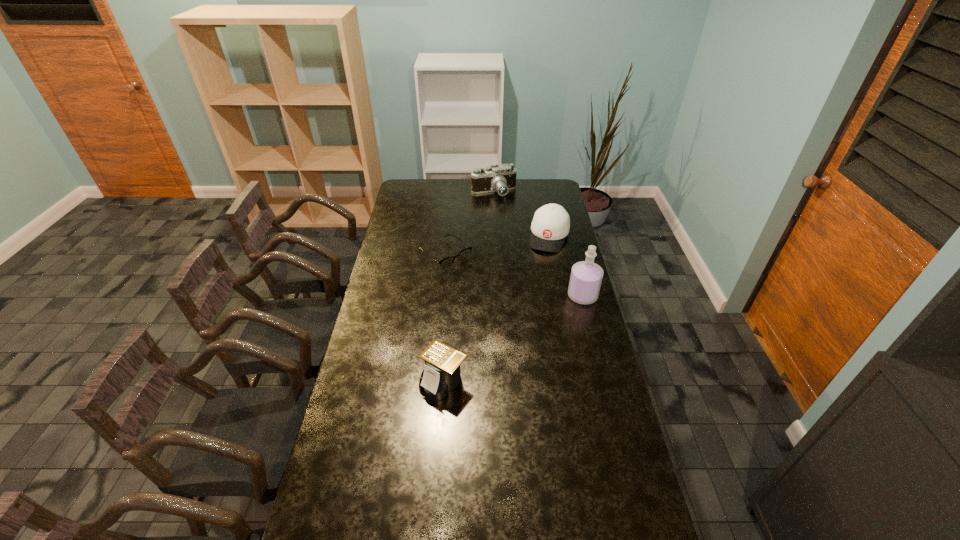
Identify the location of vacant region located 0.370m on the face of the spectacles. (x=516, y=315).

The image size is (960, 540). Find the location of `free space located on the front-facing side of the baseball cap`. free space located on the front-facing side of the baseball cap is located at coordinates click(x=533, y=299).

Find the location of a particular element. Image resolution: width=960 pixels, height=540 pixels. free space located 0.190m on the front-facing side of the baseball cap is located at coordinates (540, 279).

You are a GUI agent. You are given a task and a screenshot of the screen. Output one action in this format:
    pyautogui.click(x=<x>, y=<y>)
    Task: Click on the vacant space located on the front-facing side of the baseball cap
    This screenshot has width=960, height=540.
    Given the screenshot: What is the action you would take?
    pyautogui.click(x=539, y=281)

The width and height of the screenshot is (960, 540). I want to click on free space located at the lens of the camera, so click(x=504, y=231).

Find the location of a particular element. free spot located at the lens of the camera is located at coordinates (504, 232).

Where is `vacant region located at the lens of the camera`? vacant region located at the lens of the camera is located at coordinates (497, 206).

Where is `object at the far edge`? object at the far edge is located at coordinates (501, 178).

You are a GUI agent. You are given a task and a screenshot of the screen. Output one action in this format:
    pyautogui.click(x=<x>, y=<y>)
    Task: Click on the perfume that is at the right edge
    
    Given the screenshot: What is the action you would take?
    pyautogui.click(x=586, y=276)

In order to click on baseball cap that is at the right edge in this screenshot , I will do `click(551, 223)`.